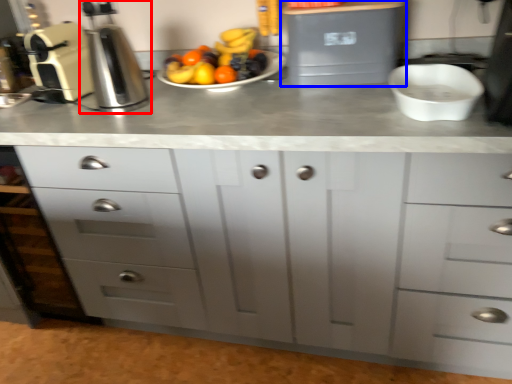
Question: Which object appears closest to the camera in this image, coffee machine (highlighted by a red box) or appliance (highlighted by a blue box)?

Choices:
 (A) coffee machine
 (B) appliance

Answer: (A)